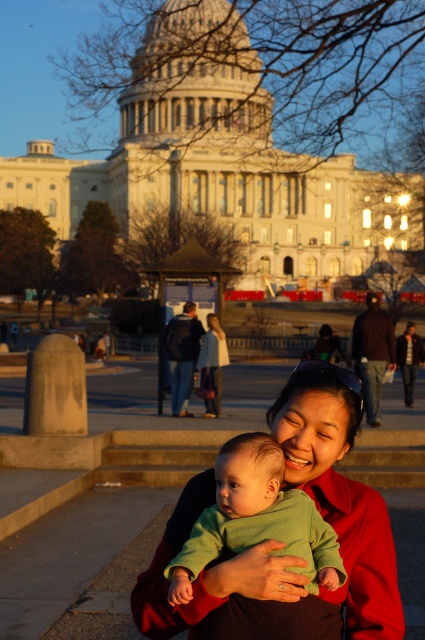
Question: Can you confirm if matte green sweater at center is positioned above green soft baby at center?

Choices:
 (A) no
 (B) yes

Answer: (A)

Question: Can you confirm if matte green sweater at center is bigger than green soft baby at center?

Choices:
 (A) no
 (B) yes

Answer: (B)

Question: Which object is closer to the camera taking this photo?

Choices:
 (A) green soft baby at center
 (B) matte green sweater at center

Answer: (A)

Question: Considering the relative positions of matte green sweater at center and green soft baby at center in the image provided, where is matte green sweater at center located with respect to green soft baby at center?

Choices:
 (A) left
 (B) right

Answer: (B)

Question: Which point appears farthest from the camera in this image?

Choices:
 (A) (184, 593)
 (B) (391, 625)

Answer: (B)